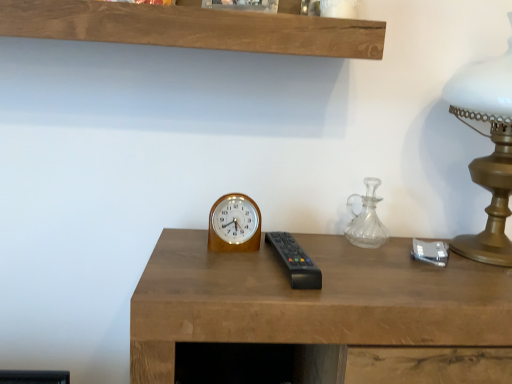
Locate an element on the screen. The height and width of the screenshot is (384, 512). vacant space to the left of gold metallic table lamp at right is located at coordinates (378, 262).